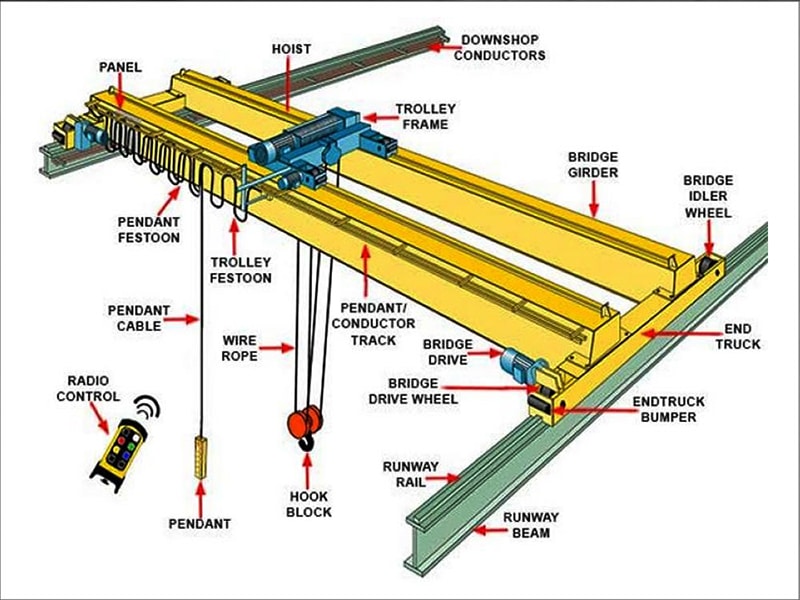
Find the location of a particular element. rectangular pillars is located at coordinates (490, 491), (516, 283), (541, 232), (306, 79).